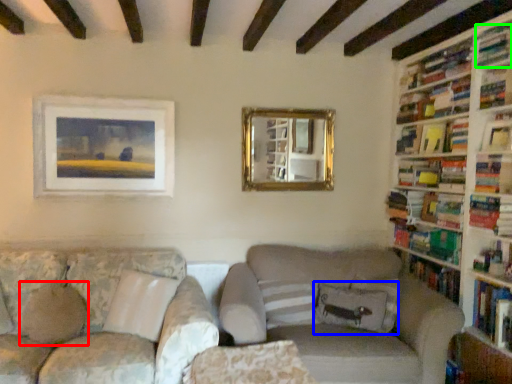
Question: Which object is positioned closest to pillow (highlighted by a red box)? Select from pillow (highlighted by a blue box) and book (highlighted by a green box).

Choices:
 (A) pillow
 (B) book

Answer: (A)